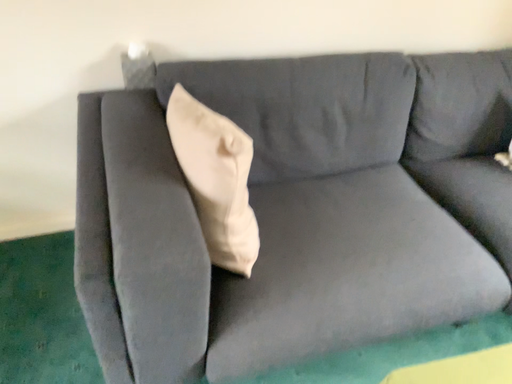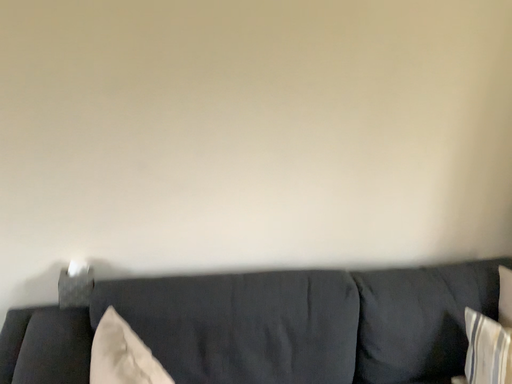
Question: Which way did the camera rotate in the video?

Choices:
 (A) rotated downward
 (B) rotated upward

Answer: (B)